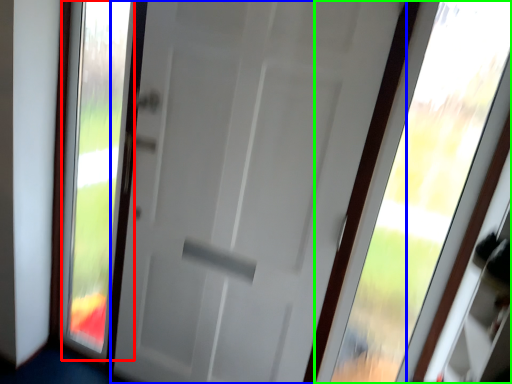
Question: Which object is positioned closest to glass window (highlighted by a red box)? Select from door (highlighted by a blue box) and window (highlighted by a green box).

Choices:
 (A) door
 (B) window

Answer: (A)